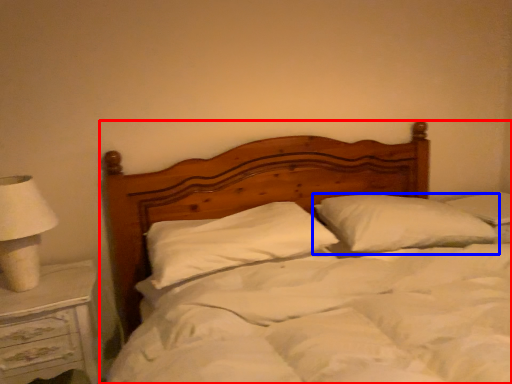
Question: Which object is closer to the camera taking this photo, bed (highlighted by a red box) or pillow (highlighted by a blue box)?

Choices:
 (A) bed
 (B) pillow

Answer: (A)